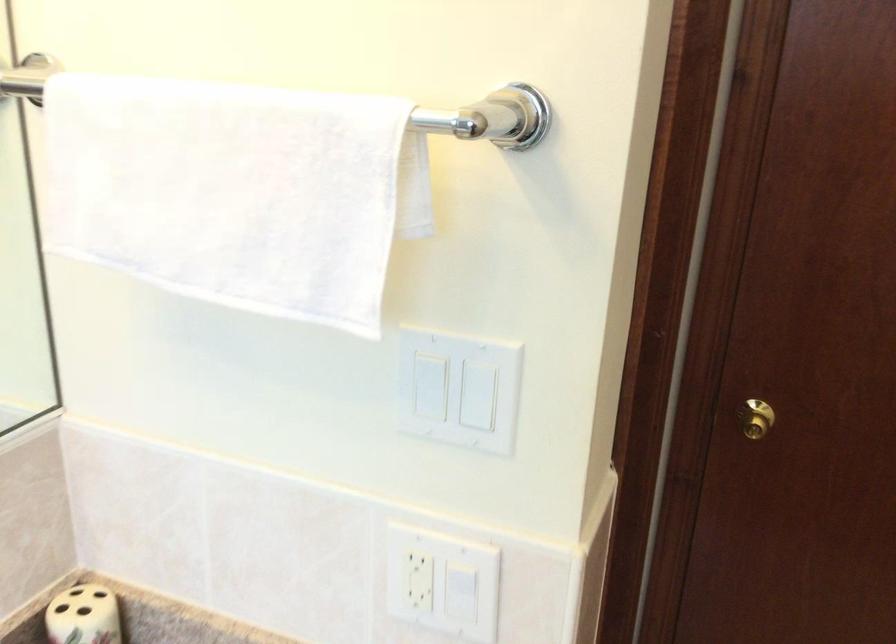
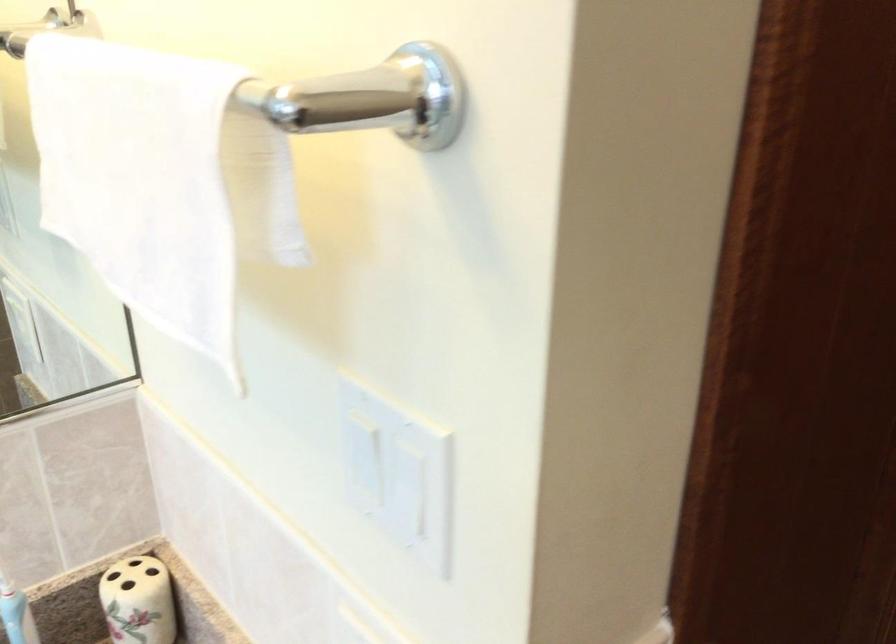
Which direction would the cameraman need to move to produce the second image?

The cameraman moved toward right, forward.